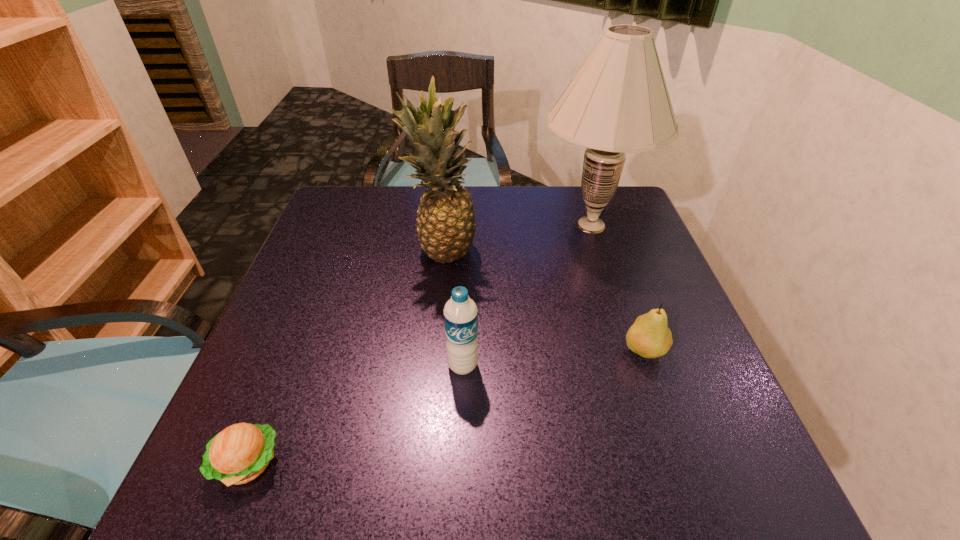
The width and height of the screenshot is (960, 540). In the image, there is a desktop. Find the location of `free space at the near edge`. free space at the near edge is located at coordinates (349, 467).

The image size is (960, 540). What are the coordinates of `vacant space at the left edge` in the screenshot? It's located at (334, 273).

I want to click on vacant space at the right edge of the desktop, so pyautogui.click(x=649, y=249).

Image resolution: width=960 pixels, height=540 pixels. In the image, there is a desktop. Identify the location of vacant region at the far left corner. (353, 207).

The image size is (960, 540). In order to click on vacant space at the near left corner of the desktop in this screenshot , I will do `click(292, 453)`.

What are the coordinates of `vacant area that lies between the water bottle and the second shortest object` in the screenshot? It's located at (553, 358).

Locate an element on the screen. This screenshot has width=960, height=540. free area in between the third shortest object and the shortest object is located at coordinates (355, 414).

This screenshot has height=540, width=960. Identify the location of free space between the tallest object and the nearest object. (420, 344).

The image size is (960, 540). Identify the location of free spot between the pear and the tallest object. (617, 288).

The image size is (960, 540). I want to click on free space between the pear and the pineapple, so click(x=543, y=301).